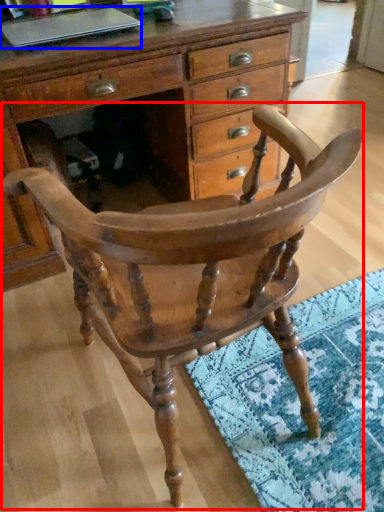
Question: Which of the following is the closest to the observer, chair (highlighted by a red box) or laptop (highlighted by a blue box)?

Choices:
 (A) chair
 (B) laptop

Answer: (A)